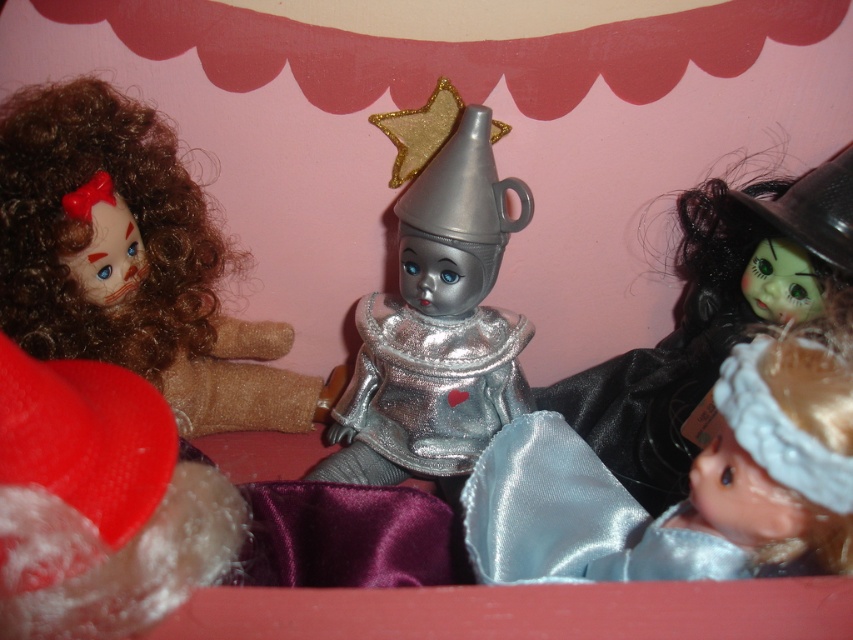
Question: Which point appears closest to the camera in this image?

Choices:
 (A) (187, 355)
 (B) (489, 378)
 (C) (775, 356)

Answer: (C)

Question: Can you confirm if satin blue dress at lower right is positioned to the left of shiny black witch hat at right?

Choices:
 (A) no
 (B) yes

Answer: (B)

Question: Is metallic silver tin at center positioned behind shiny black witch hat at right?

Choices:
 (A) no
 (B) yes

Answer: (B)

Question: Can you confirm if satin blue dress at lower right is wider than shiny black witch hat at right?

Choices:
 (A) yes
 (B) no

Answer: (B)

Question: Based on their relative distances, which object is farther from the satin blue dress at lower right?

Choices:
 (A) metallic silver tin at center
 (B) matte brown doll at left
 (C) shiny black witch hat at right

Answer: (B)

Question: Which of these objects is positioned closest to the matte brown doll at left?

Choices:
 (A) metallic silver tin at center
 (B) satin blue dress at lower right
 (C) shiny black witch hat at right

Answer: (A)